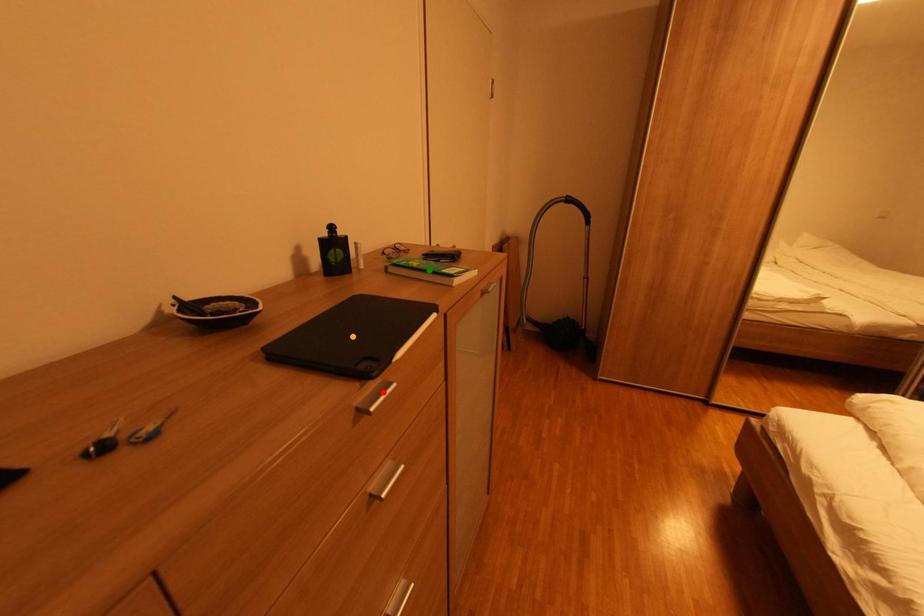
Order these from nearest to farthest:
red point, orange point, green point

red point < orange point < green point